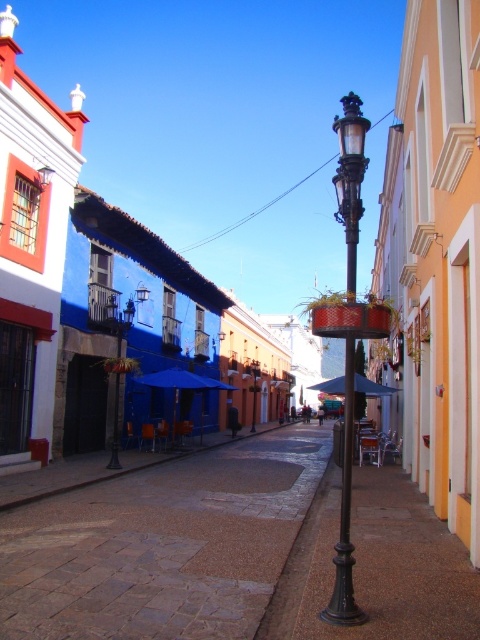
Is polished brass street light at center above black polished street light at center?

Indeed, polished brass street light at center is positioned over black polished street light at center.

I want to click on polished brass street light at center, so click(350, 180).

Which is below, brown cobblestone pavement at center or polished brass streetlight at center?

brown cobblestone pavement at center is below.

Does point (51, 552) come closer to viewer compared to point (137, 291)?

That is True.

Is point (266, 529) behind point (117, 342)?

No.

You are a GUI agent. You are given a task and a screenshot of the screen. Output one action in this format:
    pyautogui.click(x=<x>, y=<y>)
    Task: Click on the brown cobblestone pavement at center
    The image size is (480, 640).
    Given the screenshot: What is the action you would take?
    pyautogui.click(x=162, y=545)

Is polished brass streetlight at center above black polished street light at center?

Yes.

Is the position of polished brass streetlight at center less distant than that of black polished street light at center?

Yes, polished brass streetlight at center is in front of black polished street light at center.

Measure the distance between point (128, 314) and camera.

Point (128, 314) and camera are 16.76 meters apart from each other.

Image resolution: width=480 pixels, height=640 pixels. I want to click on polished brass streetlight at center, so click(121, 365).